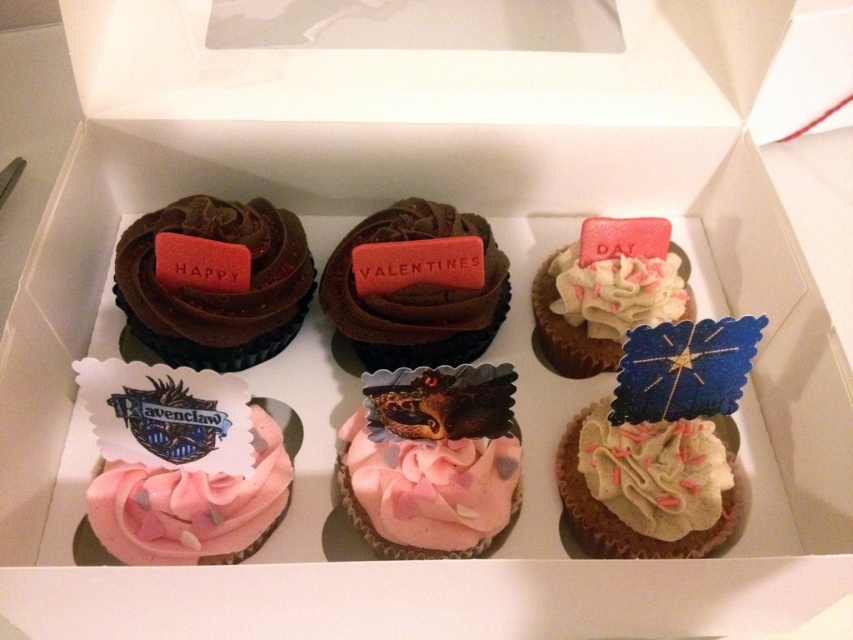
Question: Can you confirm if pink frosted cupcake at lower left is positioned above white sprinkled cupcake at center right?

Choices:
 (A) no
 (B) yes

Answer: (A)

Question: Which of the following is the closest to the observer?

Choices:
 (A) chocolate matte valentine's day sign at center
 (B) pink frosted cupcake with heart sprinkles at center
 (C) white sprinkled cupcake at center right
 (D) chocolate matte cupcake at upper left

Answer: (B)

Question: Among these points, which one is nearest to the camera?

Choices:
 (A) (184, 481)
 (B) (171, 218)
 (C) (578, 288)
 (D) (682, 308)

Answer: (A)

Question: Does matte white cupcake at upper right lie behind white frosted cupcake with sprinkles at center?

Choices:
 (A) yes
 (B) no

Answer: (A)

Question: Which of these objects is positioned farthest from the chocolate matte cupcake at upper left?

Choices:
 (A) white frosted cupcake with sprinkles at center
 (B) chocolate matte valentine's day sign at center
 (C) matte white cupcake at upper right

Answer: (A)

Question: Does pink frosted cupcake with heart sprinkles at center appear under white frosted cupcake with sprinkles at center?

Choices:
 (A) no
 (B) yes

Answer: (A)